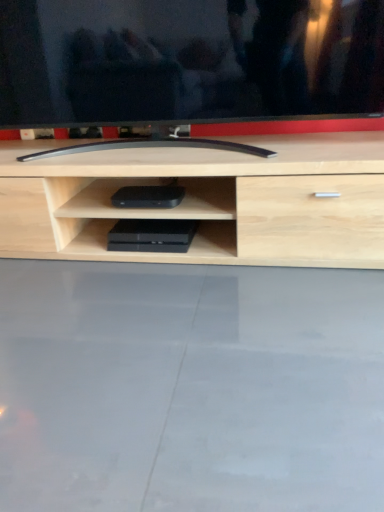
Locate an element on the screen. vacant position to the left of black plastic game console at center, positioned as the second equipment in top-to-bottom order is located at coordinates (94, 249).